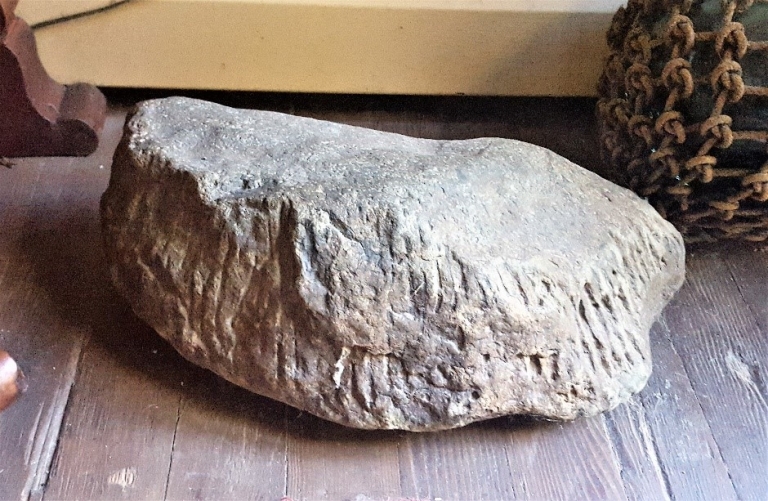
This screenshot has width=768, height=501. Find the location of `wooden plank`. wooden plank is located at coordinates (27, 414), (101, 451), (222, 442), (332, 457), (449, 459), (586, 464), (704, 477), (745, 436), (756, 276).